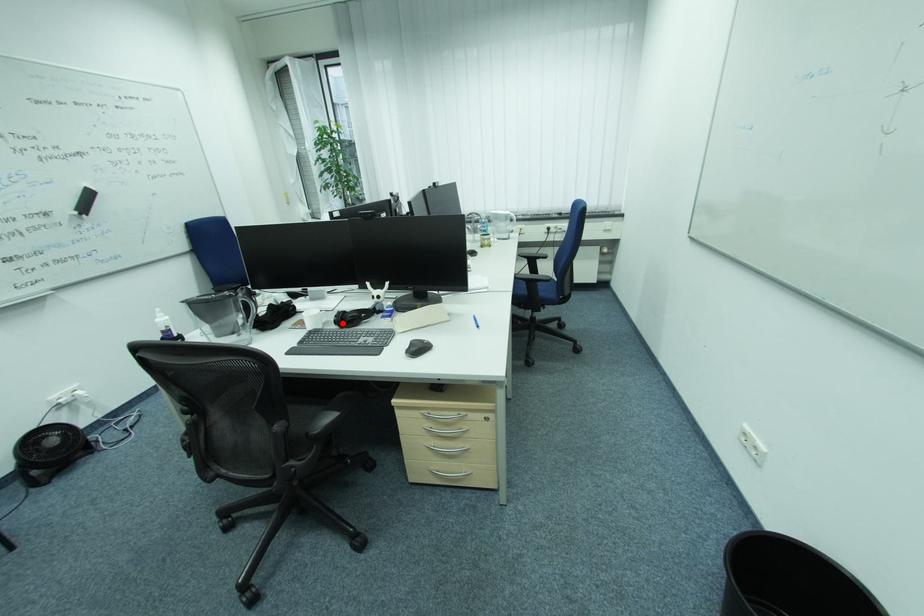
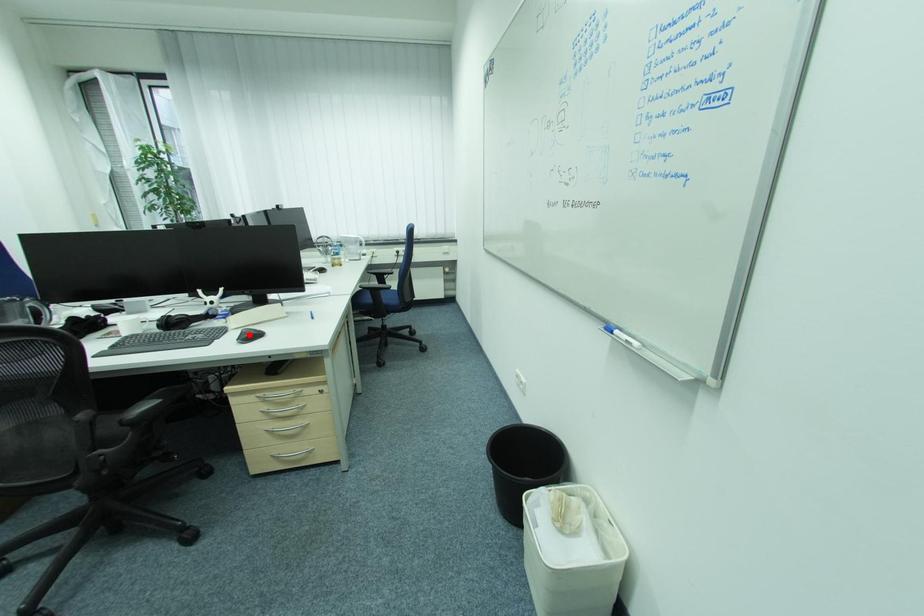
I am providing you with two images of the same scene from different viewpoints. A red point is marked on the first image and another point is marked on the second image. Do the highlighted points in image1 and image2 indicate the same real-world spot?

No